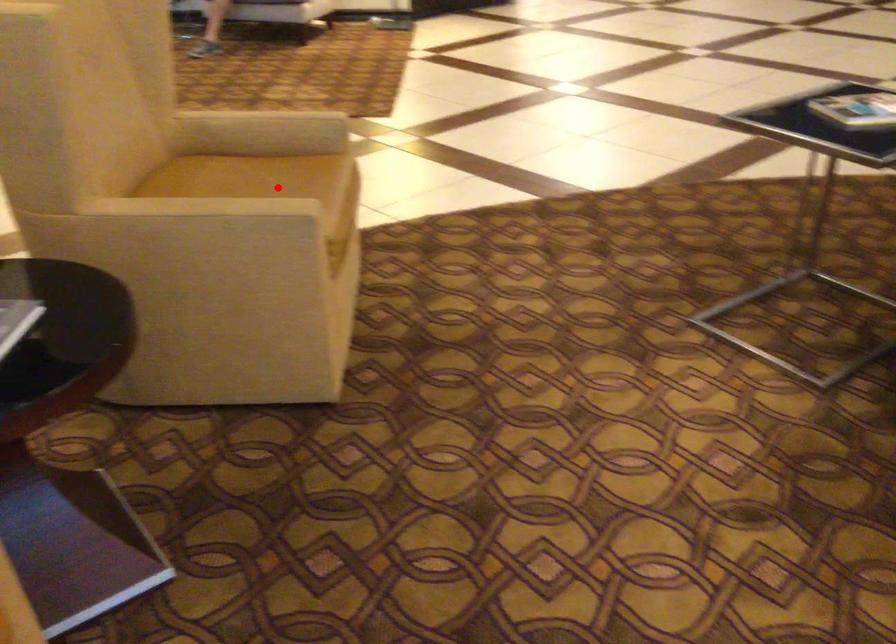
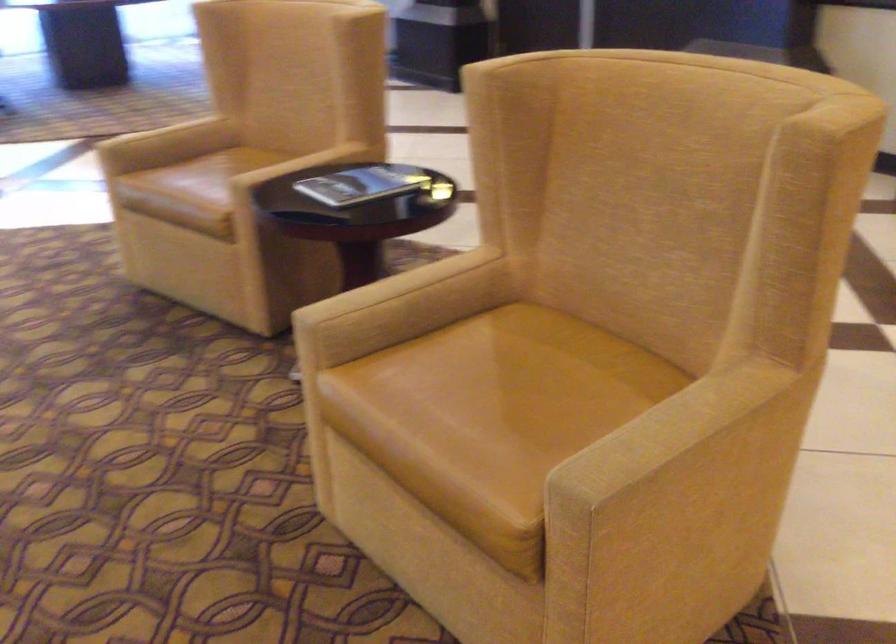
Question: I am providing you with two images of the same scene from different viewpoints. A red point is shown in image1. For the corresponding object point in image2, is it positioned nearer or farther from the camera?

Choices:
 (A) Nearer
 (B) Farther

Answer: (A)